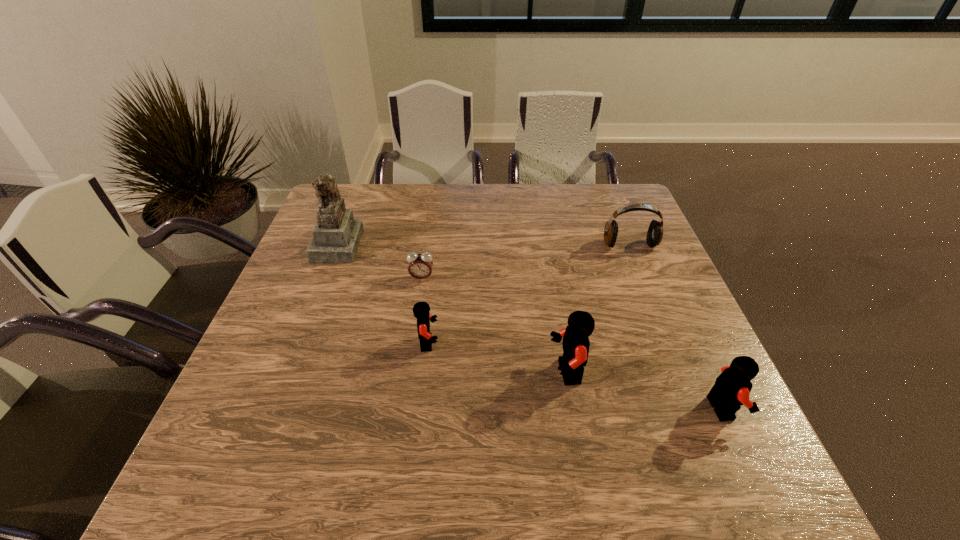
The Legos are evenly distributed in the image. To maintain this, where would you place another Lego on the left? Please point to a free space. Please provide its 2D coordinates. Your answer should be formatted as a tuple, i.e. [(x, y)], where the tuple contains the x and y coordinates of a point satisfying the conditions above.

[(307, 316)]